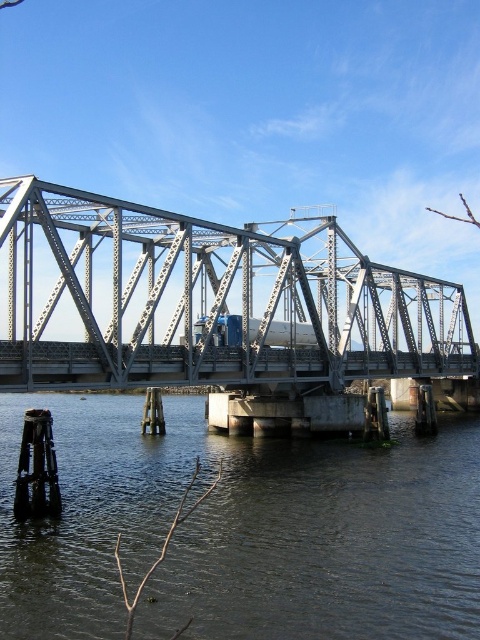
How far apart are dark gray water at lower center and metallic gray bridge at center?

dark gray water at lower center and metallic gray bridge at center are 23.43 meters apart.

Who is more forward, (188, 545) or (36, 344)?

Point (188, 545) is in front.

Does point (172, 627) come in front of point (364, 284)?

Yes, it is.

Locate an element on the screen. dark gray water at lower center is located at coordinates (242, 531).